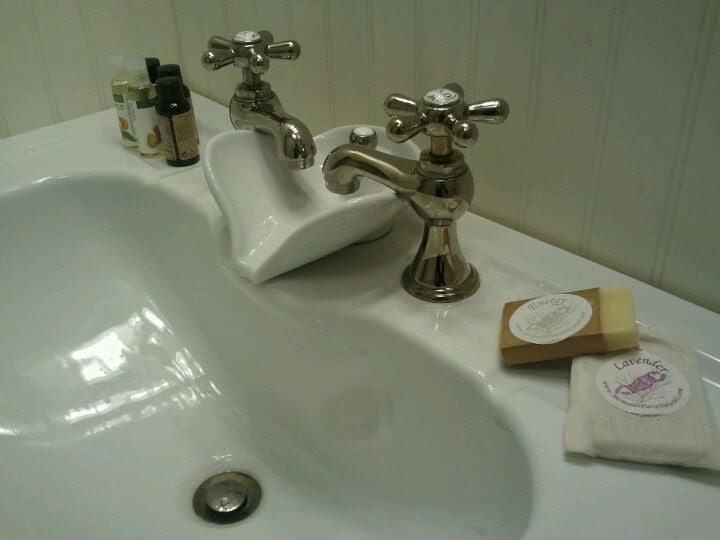
Image resolution: width=720 pixels, height=540 pixels. Find the location of `soap`. soap is located at coordinates (647, 422), (561, 312).